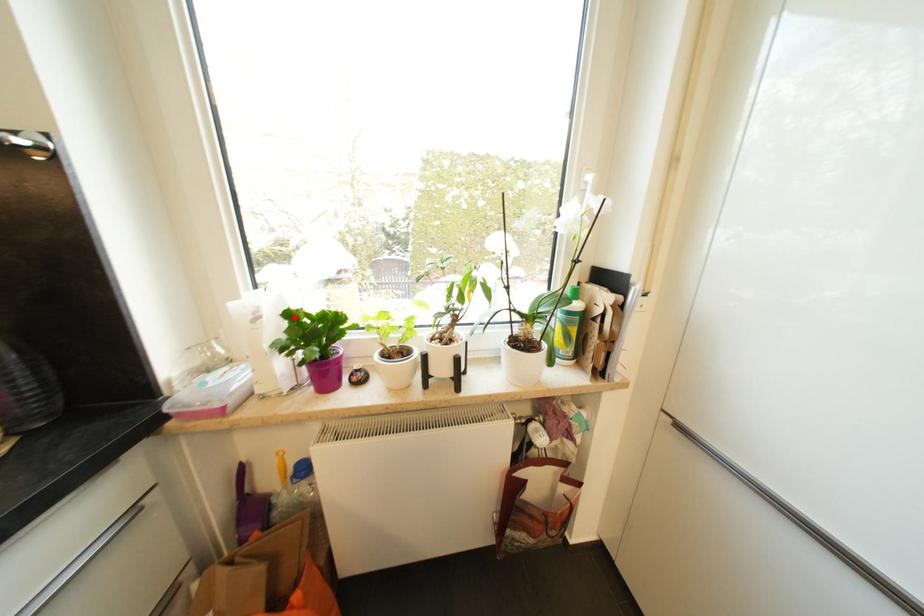
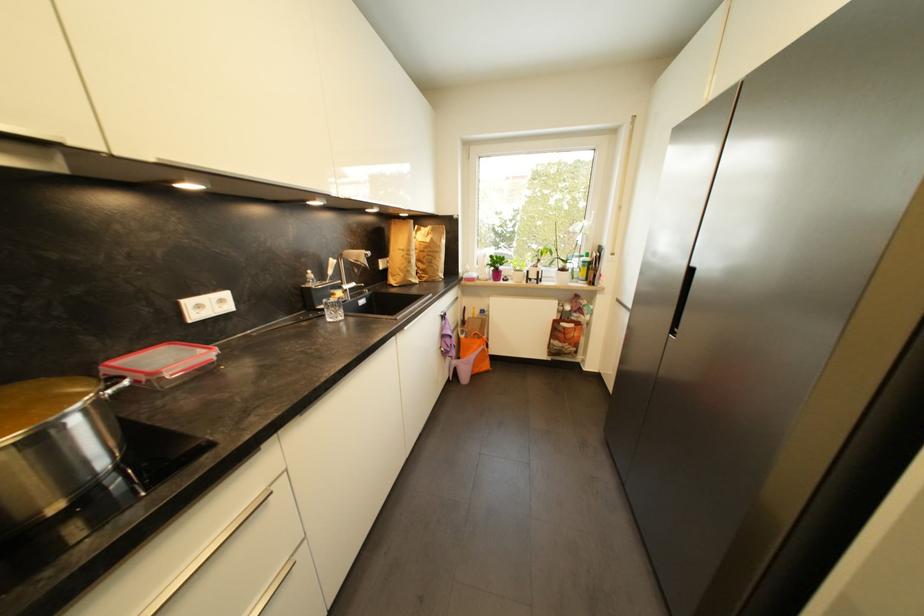
Question: I am providing you with two images of the same scene from different viewpoints. Image1 has a red point marked. In image2, the corresponding 3D location appears at what relative position? Reply with the corresponding letter.

Choices:
 (A) Closer
 (B) Farther

Answer: (A)